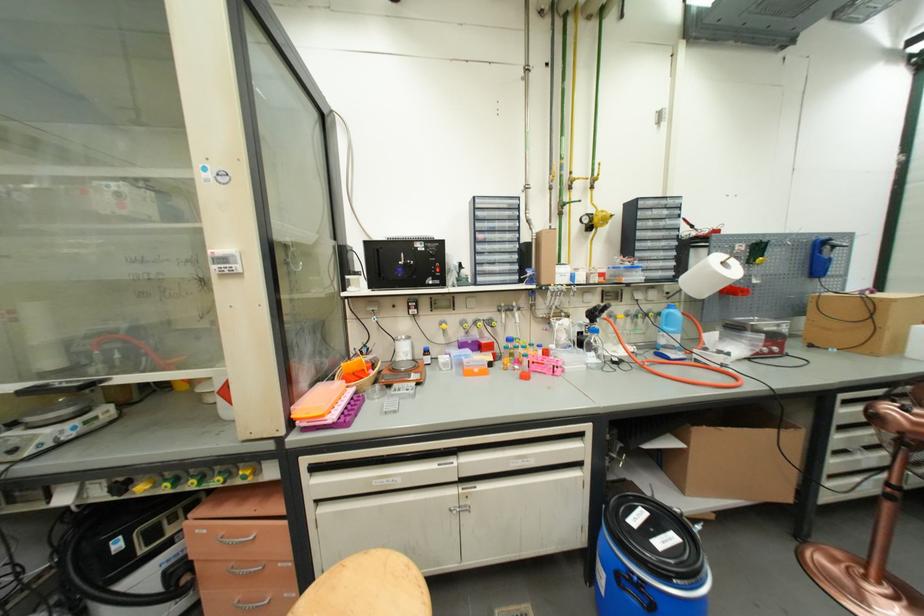
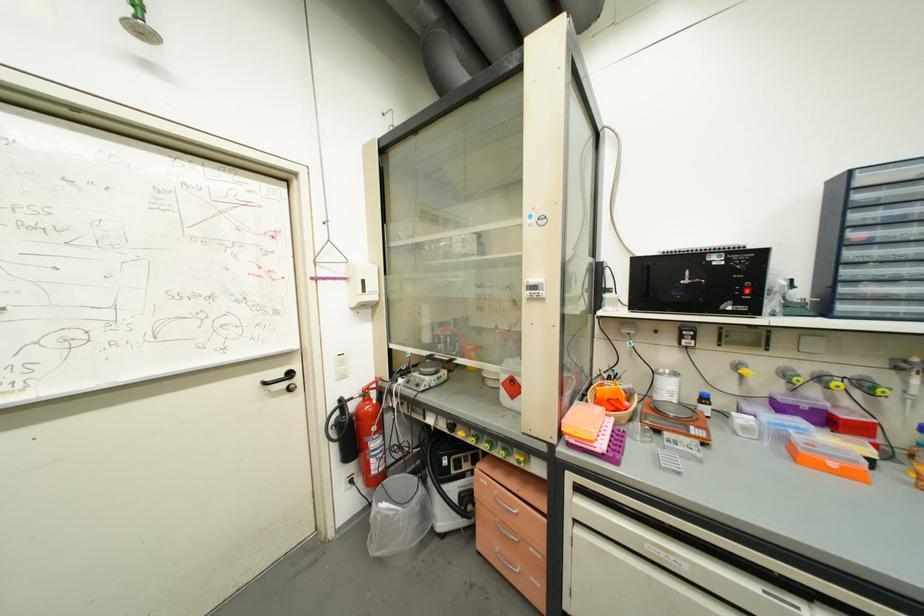
Find the pixel in the second image that matches (250,469) in the first image.

(525, 456)